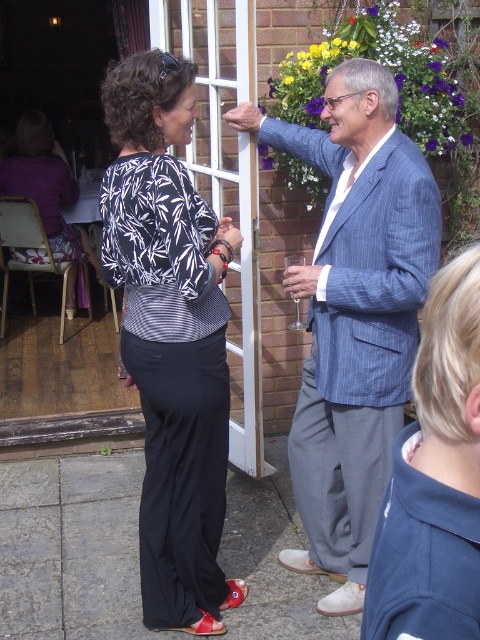
Question: Is blue striped blazer at upper right above blonde hair at right?

Choices:
 (A) yes
 (B) no

Answer: (A)

Question: Which point is closer to the camera?

Choices:
 (A) (147, 289)
 (B) (411, 522)
 (C) (302, 368)
 (D) (245, 372)

Answer: (B)

Question: Can you confirm if matte black pants at center is positioned below white glass screen door at upper center?

Choices:
 (A) no
 (B) yes

Answer: (B)

Question: Among these points, which one is farthest from the camera?

Choices:
 (A) (446, 637)
 (B) (359, 93)
 (C) (206, 531)
 (D) (153, 33)

Answer: (D)

Question: Which point is farther to the camera?

Choices:
 (A) blonde hair at right
 (B) white glass screen door at upper center
 (C) blue striped blazer at upper right
 (D) matte black pants at center

Answer: (B)

Question: Does blonde hair at right lie behind white glass screen door at upper center?

Choices:
 (A) no
 (B) yes

Answer: (A)